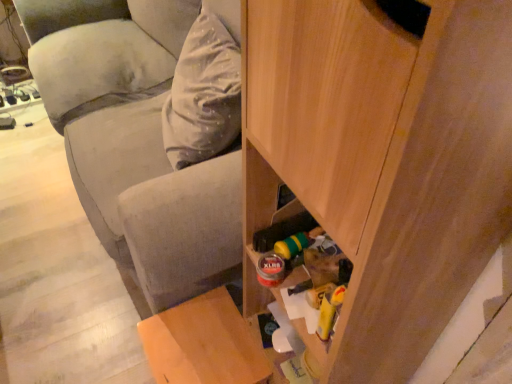
Question: Considering the positions of wooden stool at lower left and wooden cabinet at lower right in the image, is wooden stool at lower left wider or thinner than wooden cabinet at lower right?

Choices:
 (A) wide
 (B) thin

Answer: (B)

Question: From a real-world perspective, relative to wooden cabinet at lower right, is wooden stool at lower left vertically above or below?

Choices:
 (A) below
 (B) above

Answer: (A)

Question: Which of these objects is positioned closest to the wooden stool at lower left?

Choices:
 (A) velvety gray pillow at upper left
 (B) wooden cabinet at lower right

Answer: (B)

Question: Estimate the real-world distances between objects in this image. Which object is closer to the velvety gray pillow at upper left?

Choices:
 (A) wooden stool at lower left
 (B) wooden cabinet at lower right

Answer: (A)